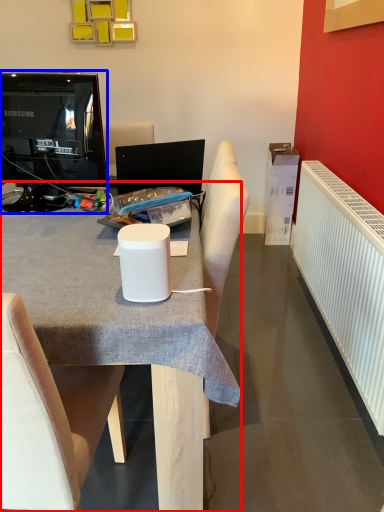
Question: Which object is closer to the camera taking this photo, desk (highlighted by a red box) or television (highlighted by a blue box)?

Choices:
 (A) desk
 (B) television

Answer: (A)